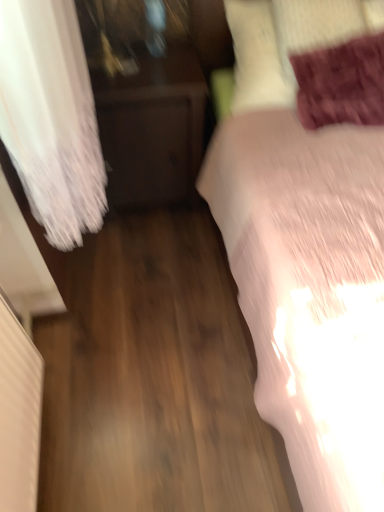
Question: From the image's perspective, is white soft bed at right located above dark wood nightstand at left?

Choices:
 (A) no
 (B) yes

Answer: (A)

Question: Are white soft bed at right and dark wood nightstand at left located far from each other?

Choices:
 (A) no
 (B) yes

Answer: (A)

Question: Is white soft bed at right next to dark wood nightstand at left and touching it?

Choices:
 (A) yes
 (B) no

Answer: (B)

Question: Considering the relative sizes of white soft bed at right and dark wood nightstand at left in the image provided, is white soft bed at right thinner than dark wood nightstand at left?

Choices:
 (A) yes
 (B) no

Answer: (B)

Question: From the image's perspective, is white soft bed at right below dark wood nightstand at left?

Choices:
 (A) no
 (B) yes

Answer: (B)

Question: Considering the positions of dark wood nightstand at left and velvet purple pillow at upper right in the image, is dark wood nightstand at left taller or shorter than velvet purple pillow at upper right?

Choices:
 (A) tall
 (B) short

Answer: (A)

Question: From a real-world perspective, is dark wood nightstand at left above or below velvet purple pillow at upper right?

Choices:
 (A) below
 (B) above

Answer: (A)

Question: Looking at the image, does dark wood nightstand at left seem bigger or smaller compared to velvet purple pillow at upper right?

Choices:
 (A) small
 (B) big

Answer: (B)

Question: Does point (110, 195) appear closer or farther from the camera than point (306, 37)?

Choices:
 (A) farther
 (B) closer

Answer: (A)

Question: Is dark wood nightstand at left inside or outside of white soft bed at right?

Choices:
 (A) outside
 (B) inside

Answer: (A)

Question: From the image's perspective, is dark wood nightstand at left above or below white soft bed at right?

Choices:
 (A) above
 (B) below

Answer: (A)

Question: From a real-world perspective, is dark wood nightstand at left above or below white soft bed at right?

Choices:
 (A) above
 (B) below

Answer: (B)

Question: Considering the positions of dark wood nightstand at left and white soft bed at right in the image, is dark wood nightstand at left taller or shorter than white soft bed at right?

Choices:
 (A) tall
 (B) short

Answer: (B)

Question: Visually, is white soft bed at right positioned to the left or to the right of velvet purple pillow at upper right?

Choices:
 (A) right
 (B) left

Answer: (A)

Question: From the image's perspective, is white soft bed at right above or below velvet purple pillow at upper right?

Choices:
 (A) below
 (B) above

Answer: (A)